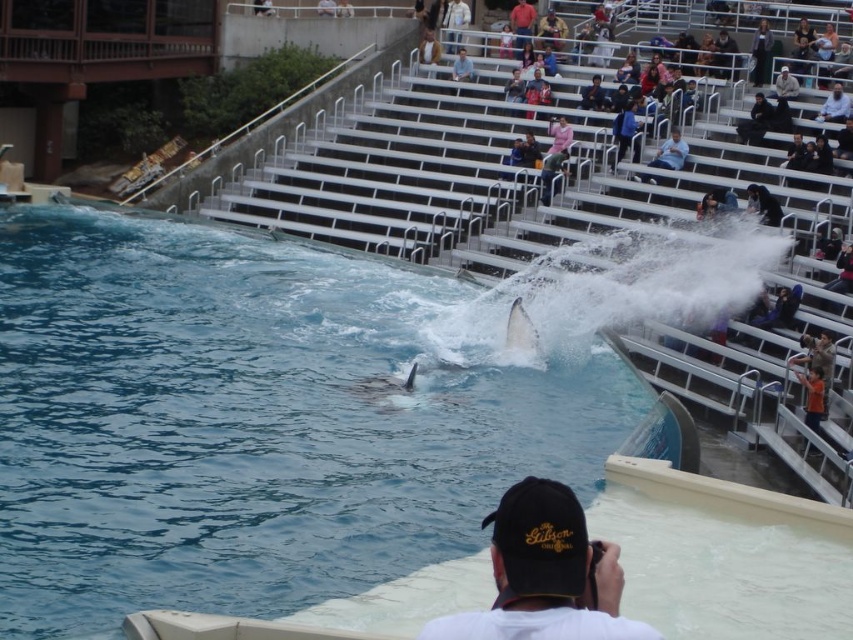
Question: Is white smooth dolphin at center to the right of red matte shirt at upper center from the viewer's perspective?

Choices:
 (A) no
 (B) yes

Answer: (A)

Question: Does clear blue water at center have a smaller size compared to black fabric cap at lower center?

Choices:
 (A) no
 (B) yes

Answer: (A)

Question: Considering the relative positions of white smooth dolphin at center and red matte shirt at upper center in the image provided, where is white smooth dolphin at center located with respect to red matte shirt at upper center?

Choices:
 (A) below
 (B) above

Answer: (A)

Question: Which object appears closest to the camera in this image?

Choices:
 (A) black fabric cap at lower center
 (B) blue fabric shirt at upper center

Answer: (A)

Question: Which object appears farthest from the camera in this image?

Choices:
 (A) blue fabric shirt at upper center
 (B) black fabric cap at lower center
 (C) black leather jacket at upper center

Answer: (C)

Question: Which of the following is the closest to the observer?

Choices:
 (A) blue fabric shirt at upper center
 (B) black leather jacket at upper center
 (C) black fabric cap at lower center

Answer: (C)